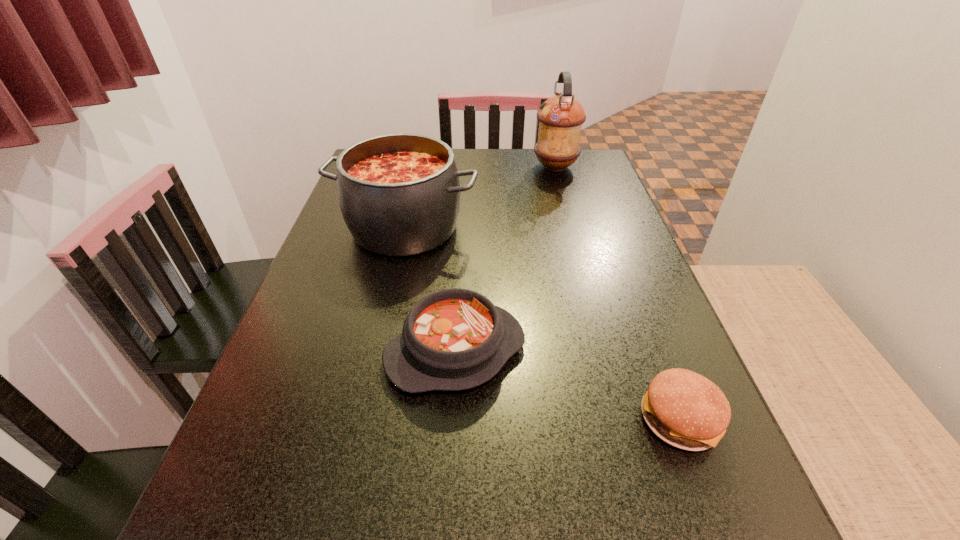
Where is `free space between the farthest object and the shortest object`? This screenshot has height=540, width=960. free space between the farthest object and the shortest object is located at coordinates (617, 293).

Locate an element on the screen. The width and height of the screenshot is (960, 540). vacant point located between the farther casserole and the second shortest object is located at coordinates (430, 290).

The height and width of the screenshot is (540, 960). What are the coordinates of `free space between the shortest object and the farthest object` in the screenshot? It's located at (617, 293).

At what (x,y) coordinates should I click in order to perform the action: click on vacant region between the shorter casserole and the shortest object. Please return your answer as a coordinate pair (x, y). Looking at the image, I should click on (567, 385).

You are a GUI agent. You are given a task and a screenshot of the screen. Output one action in this format:
    pyautogui.click(x=<x>, y=<y>)
    Task: Click on the free space between the second shortest object and the hamburger
    The image size is (960, 540).
    Given the screenshot: What is the action you would take?
    pyautogui.click(x=567, y=385)

Locate an element on the screen. The image size is (960, 540). free space between the farther casserole and the nearer casserole is located at coordinates (430, 290).

This screenshot has width=960, height=540. Find the location of `vacant space that is in between the oil lamp and the hamburger`. vacant space that is in between the oil lamp and the hamburger is located at coordinates (617, 293).

This screenshot has height=540, width=960. Identify the location of free point between the farthest object and the farther casserole. (480, 198).

Where is `vacant point located between the hamburger and the third nearest object`? The height and width of the screenshot is (540, 960). vacant point located between the hamburger and the third nearest object is located at coordinates (542, 323).

Where is `object that ranks as the second closest to the shortest object`? This screenshot has height=540, width=960. object that ranks as the second closest to the shortest object is located at coordinates (399, 194).